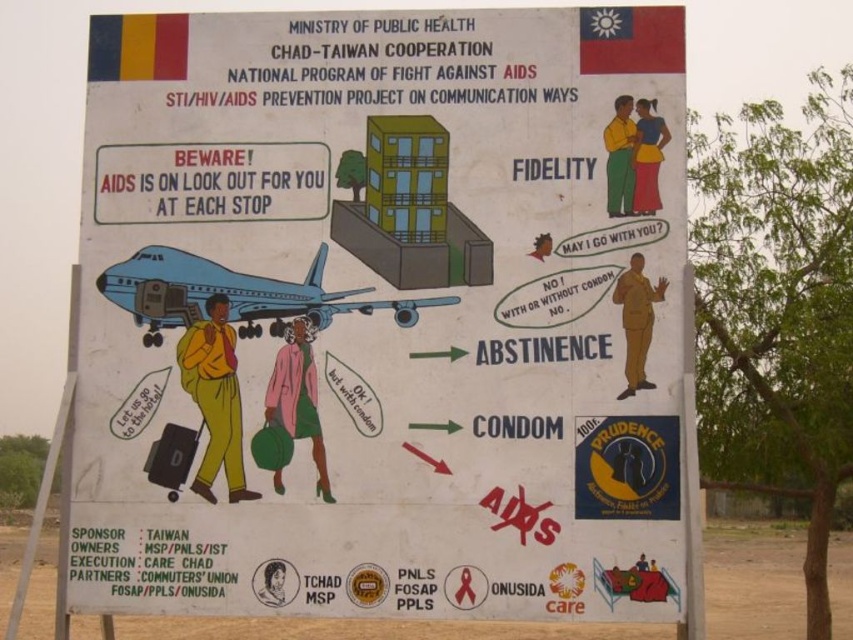
You are a graphic designer reviewing the poster. The client mentioned they want to ensure the white paper poster at center and the light blue glossy airplane at left are proportionate. Based on the provided description, which object is taller and by how much?

The white paper poster at center is much taller than the light blue glossy airplane at left according to the description.

What is the spatial relationship between the white paper poster at center and the light blue glossy airplane at left in the central warning section of the AIDS prevention poster?

The white paper poster at center is to the right of the light blue glossy airplane at left.

What is the relationship in size between the white paper poster at center and the light blue glossy airplane at left in the image?

The white paper poster at center is bigger than the light blue glossy airplane at left.